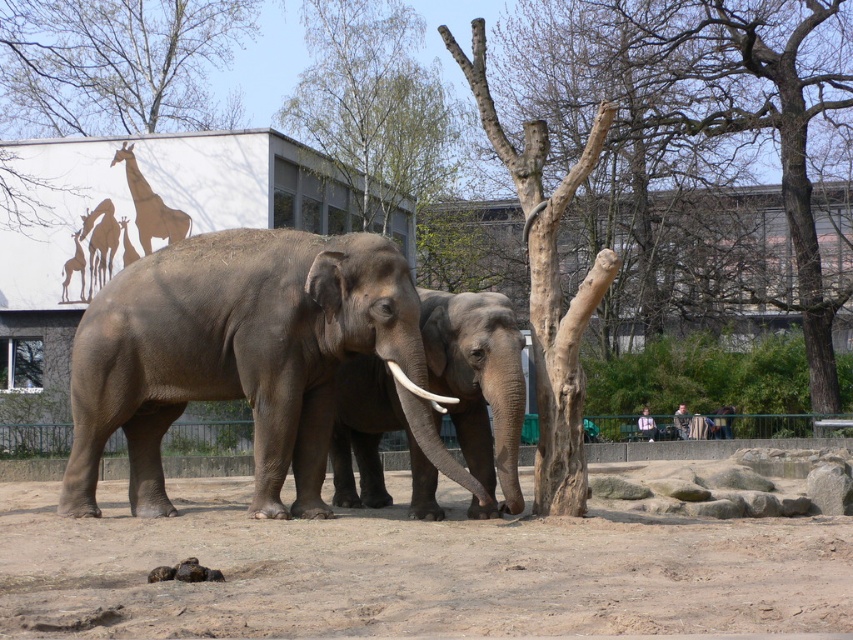
You are a zookeeper planning to place a new feeding station between the gray textured elephant at center and the bare wood tree at upper center. Since the feeding station requires a space larger than the larger of the two objects, which object should you consider the size of when determining the minimum space needed?

The bare wood tree at upper center occupies more space than the gray textured elephant at center, so you should consider the size of the bare wood tree at upper center to determine the minimum space needed for the feeding station.

You are a zookeeper trying to place a new feeding trough between the gray textured elephant at center and the bare wood tree at upper center. The trough requires a minimum of 2 meters of space. Can you determine if there is enough space between them based on their widths?

The gray textured elephant at center has a lesser width compared to the bare wood tree at upper center. However, the exact widths are not provided, so we cannot definitively determine if the 2 meters of space required for the feeding trough is available. Additional measurements are needed.